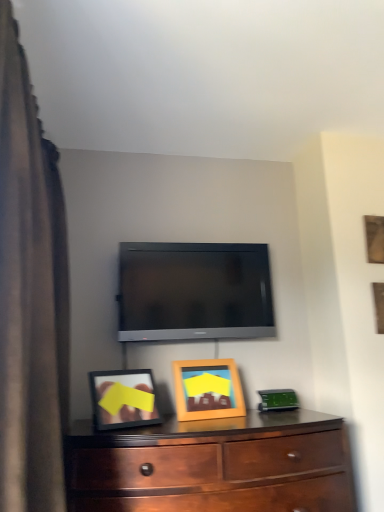
Question: Is brown fabric curtain at left aimed at mahogany wood dresser at lower center?

Choices:
 (A) yes
 (B) no

Answer: (A)

Question: Can you see brown fabric curtain at left touching mahogany wood dresser at lower center?

Choices:
 (A) yes
 (B) no

Answer: (B)

Question: From a real-world perspective, is brown fabric curtain at left on top of mahogany wood dresser at lower center?

Choices:
 (A) yes
 (B) no

Answer: (A)

Question: Is brown fabric curtain at left smaller than mahogany wood dresser at lower center?

Choices:
 (A) no
 (B) yes

Answer: (A)

Question: Considering the relative sizes of brown fabric curtain at left and mahogany wood dresser at lower center in the image provided, is brown fabric curtain at left taller than mahogany wood dresser at lower center?

Choices:
 (A) no
 (B) yes

Answer: (B)

Question: From the image's perspective, is brown fabric curtain at left under mahogany wood dresser at lower center?

Choices:
 (A) no
 (B) yes

Answer: (A)

Question: From a real-world perspective, does brown fabric curtain at left sit lower than matte black tv at center?

Choices:
 (A) no
 (B) yes

Answer: (B)

Question: Considering the relative positions of brown fabric curtain at left and matte black tv at center in the image provided, is brown fabric curtain at left to the right of matte black tv at center from the viewer's perspective?

Choices:
 (A) yes
 (B) no

Answer: (B)

Question: Is brown fabric curtain at left in contact with matte black tv at center?

Choices:
 (A) no
 (B) yes

Answer: (A)

Question: Can you confirm if brown fabric curtain at left is taller than matte black tv at center?

Choices:
 (A) yes
 (B) no

Answer: (A)

Question: Is brown fabric curtain at left far from matte black tv at center?

Choices:
 (A) yes
 (B) no

Answer: (B)

Question: Is brown fabric curtain at left bigger than matte black tv at center?

Choices:
 (A) yes
 (B) no

Answer: (A)

Question: From a real-world perspective, is wooden picture frame at center, which appears as the second picture frame when viewed from the right, positioned under mahogany wood dresser at lower center based on gravity?

Choices:
 (A) yes
 (B) no

Answer: (B)